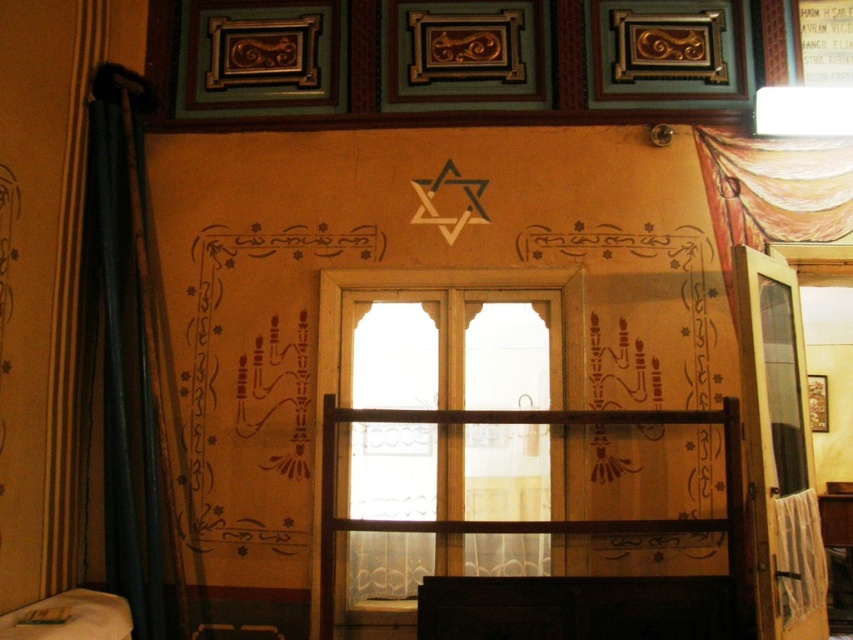
You are a visitor in the prayer hall and need to find a place to sit. You see the wooden at center and the beige fabric bed at lower left. Which one is closer to the entrance if the entrance is on the left side of the room?

The beige fabric bed at lower left is closer to the entrance because it is positioned on the left side of the room, while the wooden at center is to the right of it, making it farther from the entrance on the left.

What is the exact coordinate of the wooden at center in the image?

The wooden at center is located at coordinate point (534, 520).